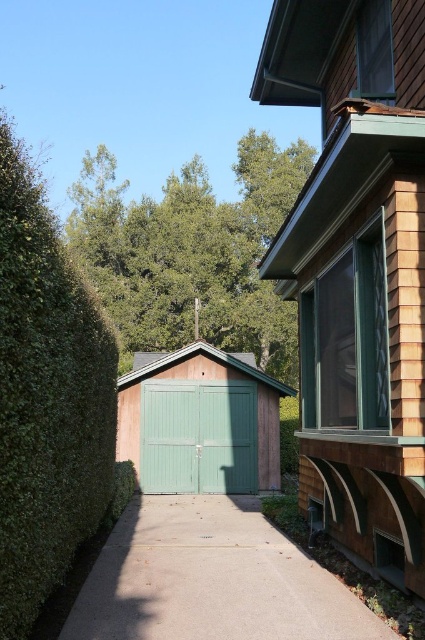
Based on the photo, you are trying to park your car in the driveway and need to know which is wider between the green woodshed at center and the green painted wood garage door at center. Which one is wider?

The green woodshed at center is wider than the green painted wood garage door at center according to the description.